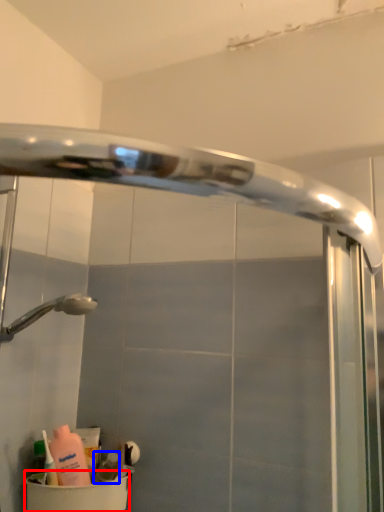
Question: Which of the following is the farthest to the observer, toilet bowl (highlighted by a red box) or toiletry (highlighted by a blue box)?

Choices:
 (A) toilet bowl
 (B) toiletry

Answer: (B)